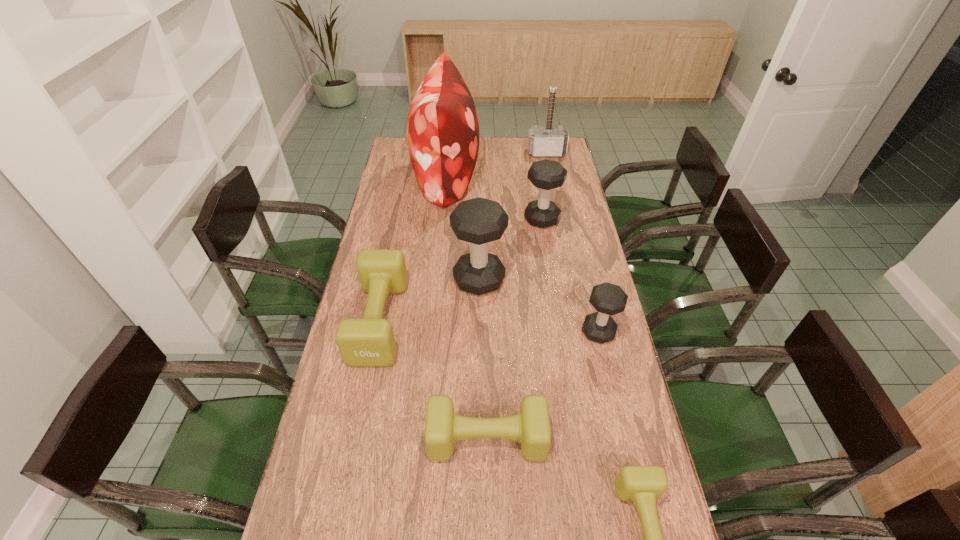
The width and height of the screenshot is (960, 540). What are the coordinates of `free space between the second smallest gray dumbbell and the smallest gray dumbbell` in the screenshot? It's located at (570, 275).

Where is `vacant area between the biggest gray dumbbell and the second biggest gray dumbbell`? vacant area between the biggest gray dumbbell and the second biggest gray dumbbell is located at coordinates (511, 249).

Find the location of a particular element. The image size is (960, 540). free spot between the smallest gray dumbbell and the second nearest object is located at coordinates tap(542, 386).

Identify which object is the seventh nearest to the biggest gray dumbbell. Please provide its 2D coordinates. Your answer should be formatted as a tuple, i.e. [(x, y)], where the tuple contains the x and y coordinates of a point satisfying the conditions above.

[(543, 141)]

This screenshot has height=540, width=960. I want to click on object that is the sixth closest one to the second shortest object, so click(442, 129).

The image size is (960, 540). Find the location of `the sixth closest dumbbell to the hammer`. the sixth closest dumbbell to the hammer is located at coordinates (643, 485).

Locate an element on the screen. the closest dumbbell to the leftmost olive dumbbell is located at coordinates (478, 221).

At what (x,y) coordinates should I click in order to perform the action: click on gray dumbbell object that ranks as the second closest to the shortest dumbbell. Please return your answer as a coordinate pair (x, y). Looking at the image, I should click on (478, 221).

Point out which gray dumbbell is positioned as the second nearest to the second nearest object. Please provide its 2D coordinates. Your answer should be formatted as a tuple, i.e. [(x, y)], where the tuple contains the x and y coordinates of a point satisfying the conditions above.

[(478, 221)]

Where is `olive dumbbell that stands as the closest to the second biggest gray dumbbell`? The width and height of the screenshot is (960, 540). olive dumbbell that stands as the closest to the second biggest gray dumbbell is located at coordinates (369, 341).